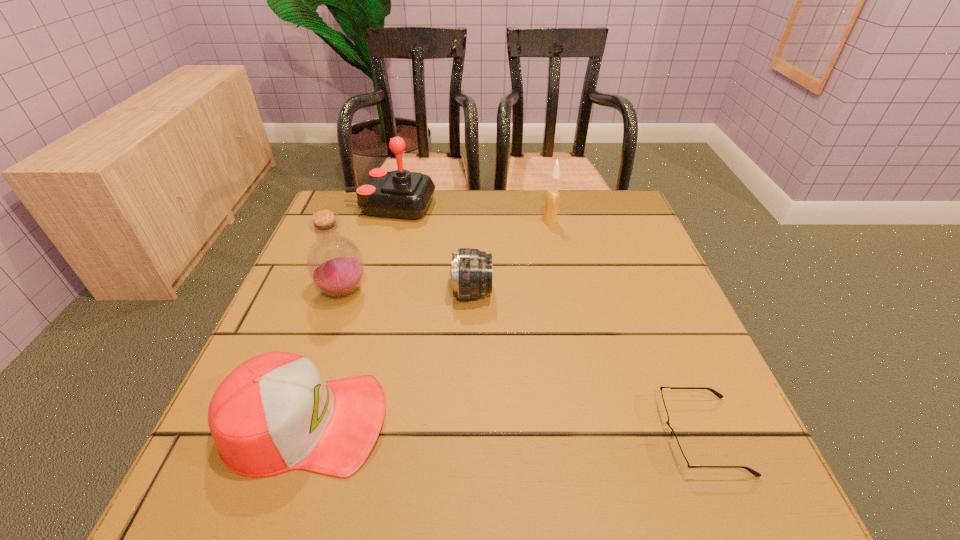
Find the location of a particular element. bottle at the left edge is located at coordinates (335, 265).

Locate an element on the screen. The height and width of the screenshot is (540, 960). baseball cap positioned at the left edge is located at coordinates (274, 413).

Identify the location of object at the right edge. This screenshot has width=960, height=540. (677, 452).

Find the location of a particular element. Image resolution: width=960 pixels, height=540 pixels. object that is at the far left corner is located at coordinates (403, 194).

The image size is (960, 540). I want to click on object at the near left corner, so click(x=274, y=413).

This screenshot has height=540, width=960. What are the coordinates of `object that is at the near right corner` in the screenshot? It's located at (677, 452).

This screenshot has width=960, height=540. In the image, there is a desktop. Identify the location of vacant space at the far edge. (497, 228).

The image size is (960, 540). I want to click on free space at the near edge, so click(x=629, y=480).

The height and width of the screenshot is (540, 960). I want to click on vacant space at the left edge, so click(300, 299).

This screenshot has height=540, width=960. I want to click on blank space at the right edge of the desktop, so click(646, 294).